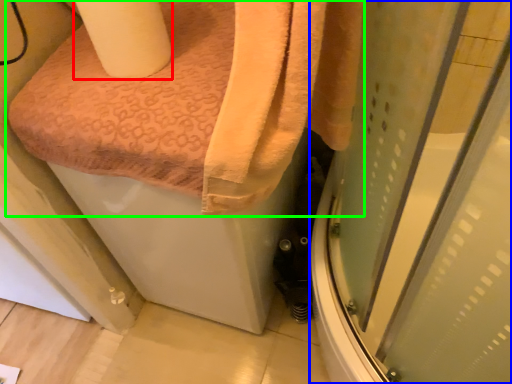
Question: Based on their relative distances, which object is nearer to toilet paper (highlighted by a red box)? Choose from screen door (highlighted by a blue box) and towel (highlighted by a green box).

Choices:
 (A) screen door
 (B) towel

Answer: (B)